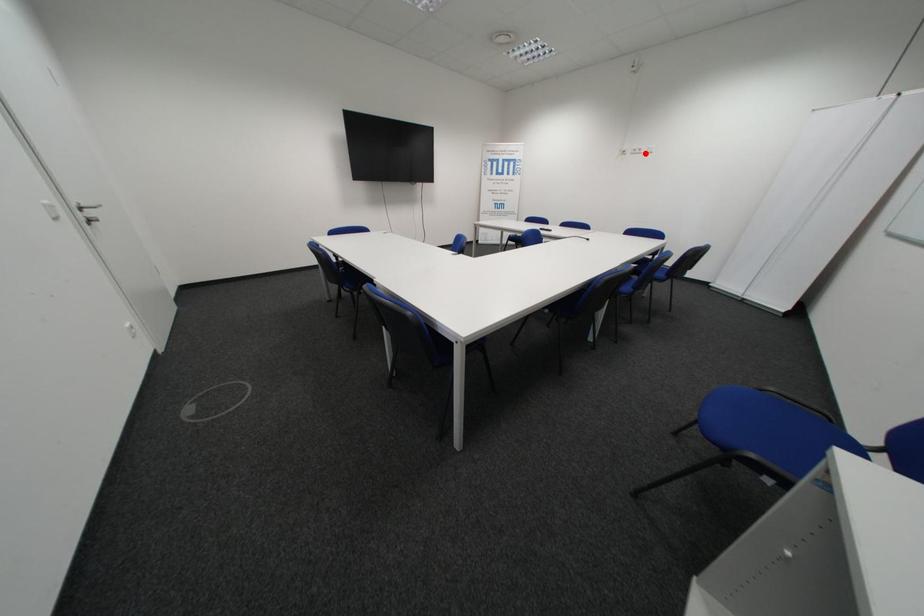
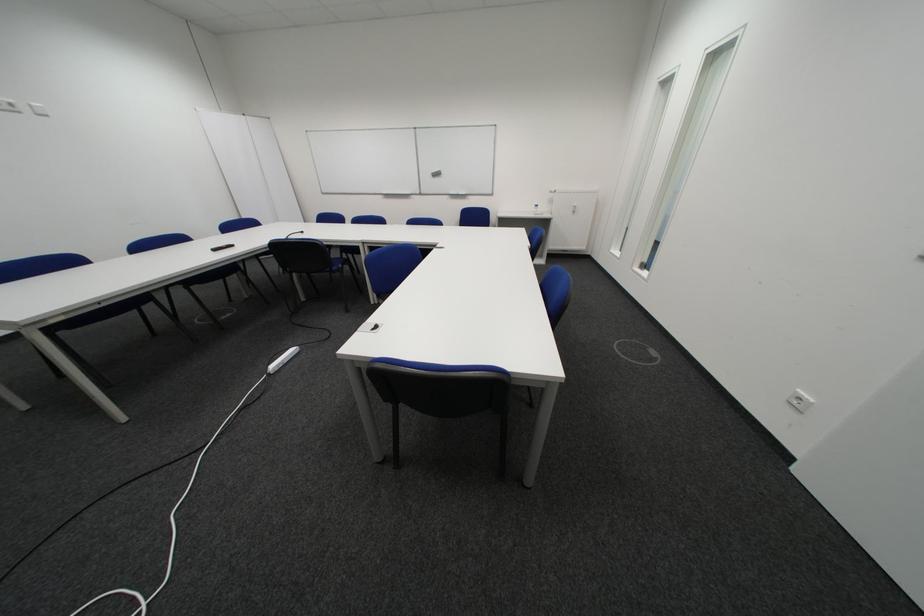
Question: I am providing you with two images of the same scene from different viewpoints. A red point is shown in image1. For the corresponding object point in image2, is it positioned nearer or farther from the camera?

Choices:
 (A) Nearer
 (B) Farther

Answer: (B)